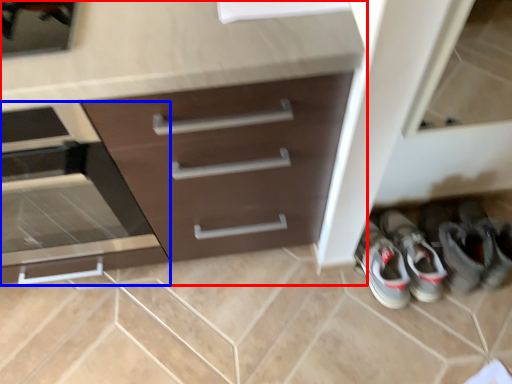
Question: Which point is closer to the camera, chest of drawers (highlighted by a red box) or drawer (highlighted by a blue box)?

Choices:
 (A) chest of drawers
 (B) drawer

Answer: (A)